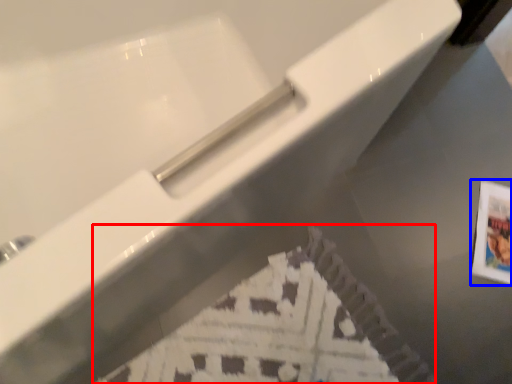
Question: Which object appears farthest to the camera in this image, flyer (highlighted by a red box) or postcard (highlighted by a blue box)?

Choices:
 (A) flyer
 (B) postcard

Answer: (B)